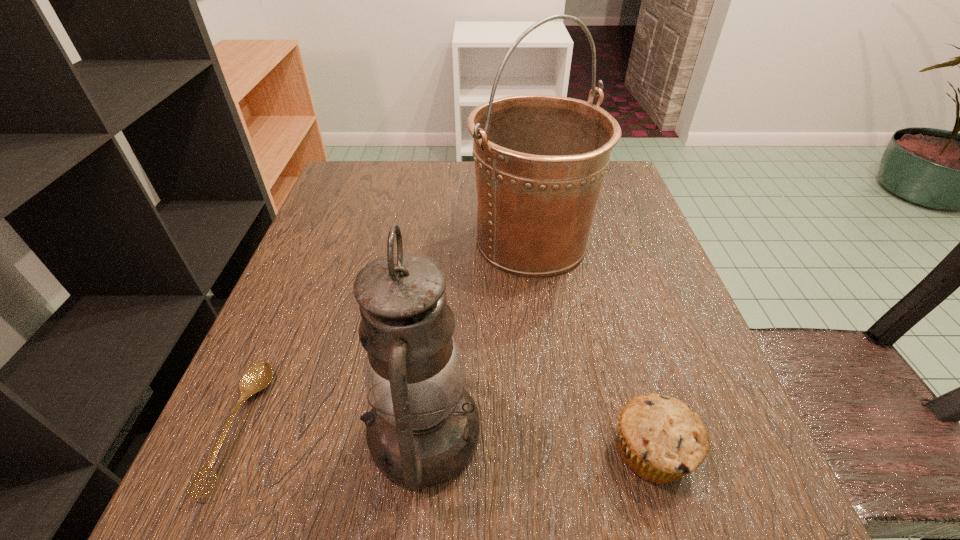
Image resolution: width=960 pixels, height=540 pixels. Identify the location of object present at the far edge. pos(540,160).

What are the coordinates of `oil lamp that is at the near edge` in the screenshot? It's located at (423, 429).

The image size is (960, 540). In order to click on muffin present at the near edge in this screenshot , I will do `click(660, 438)`.

This screenshot has height=540, width=960. What are the coordinates of `ladle positioned at the near edge` in the screenshot? It's located at (258, 377).

Where is `object that is at the left edge`? object that is at the left edge is located at coordinates (258, 377).

Where is `bucket positioned at the right edge`? Image resolution: width=960 pixels, height=540 pixels. bucket positioned at the right edge is located at coordinates (540, 160).

The height and width of the screenshot is (540, 960). Find the location of `muffin located at the right edge`. muffin located at the right edge is located at coordinates (660, 438).

At what (x,y) coordinates should I click in order to perform the action: click on object at the near left corner. Please return your answer as a coordinate pair (x, y). Image resolution: width=960 pixels, height=540 pixels. Looking at the image, I should click on click(x=258, y=377).

This screenshot has height=540, width=960. I want to click on object that is at the far right corner, so click(x=540, y=160).

Find the location of a particular element. object situated at the near right corner is located at coordinates (660, 438).